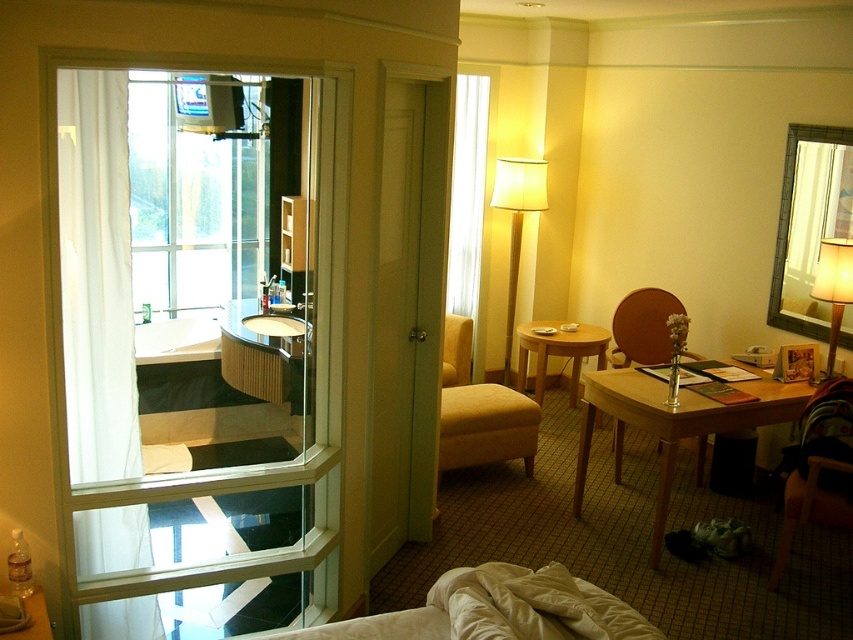
Between white sheer curtain at center and light brown wooden table at center, which one appears on the right side from the viewer's perspective?

Positioned to the right is light brown wooden table at center.

Identify the location of white sheer curtain at center. (467, 205).

Can you confirm if transparent glass door at left is positioned to the left of matte yellow armchair at center?

Correct, you'll find transparent glass door at left to the left of matte yellow armchair at center.

Does point (106, 221) come in front of point (515, 416)?

That is True.

You are a GUI agent. You are given a task and a screenshot of the screen. Output one action in this format:
    pyautogui.click(x=<x>, y=<y>)
    Task: Click on the transparent glass door at left
    Image resolution: width=853 pixels, height=640 pixels.
    Given the screenshot: What is the action you would take?
    pyautogui.click(x=198, y=344)

Identify the location of transparent glass door at left. Image resolution: width=853 pixels, height=640 pixels. (198, 344).

Which of these two, green matte closet door at center or cream fabric lampshade at center, stands shorter?

Standing shorter between the two is cream fabric lampshade at center.

Is green matte closet door at center below cream fabric lampshade at center?

Yes, green matte closet door at center is below cream fabric lampshade at center.

You are a GUI agent. You are given a task and a screenshot of the screen. Output one action in this format:
    pyautogui.click(x=<x>, y=<y>)
    Task: Click on the green matte closet door at center
    The width and height of the screenshot is (853, 640).
    Given the screenshot: What is the action you would take?
    pyautogui.click(x=408, y=312)